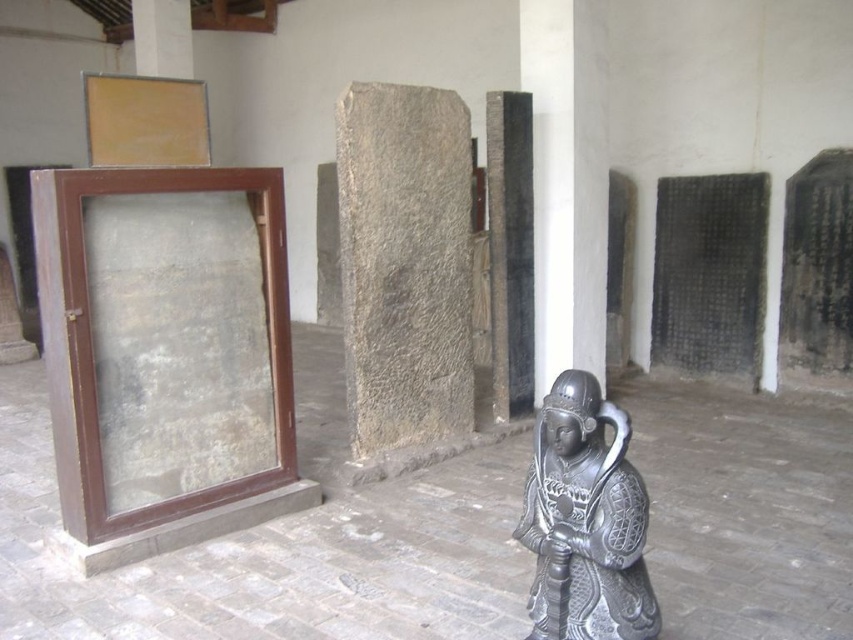
Question: Is black polished stone pillar at center to the left of white stone pillar at upper left from the viewer's perspective?

Choices:
 (A) yes
 (B) no

Answer: (B)

Question: Can you confirm if gray stone pillar at center is positioned below white stone pillar at upper left?

Choices:
 (A) yes
 (B) no

Answer: (A)

Question: Among these objects, which one is farthest from the camera?

Choices:
 (A) polished bronze statue at center
 (B) white stone pillar at upper left
 (C) gray stone pillar at center

Answer: (B)

Question: Which of these objects is positioned farthest from the black polished stone pillar at center?

Choices:
 (A) gray stone pillar at center
 (B) polished bronze statue at center

Answer: (B)

Question: Does gray stone pillar at center appear on the left side of white stone pillar at upper left?

Choices:
 (A) yes
 (B) no

Answer: (B)

Question: Which point is closer to the camera taking this photo?

Choices:
 (A) (554, 570)
 (B) (492, 400)
 (C) (393, 392)

Answer: (A)